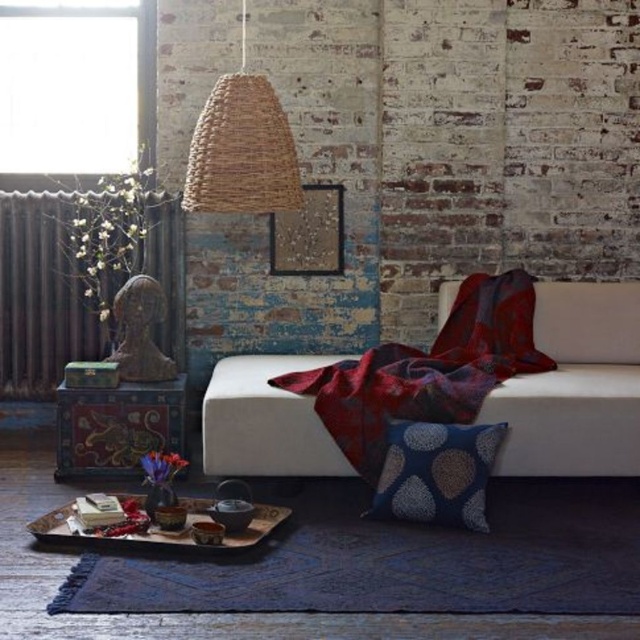
You are moving a small plant pot that is 20 cm in diameter. You want to place it on either the matte green radiator at left or the painted wood trunk at lower left. Which object can accommodate the plant pot without it falling off?

The matte green radiator at left is bigger than the painted wood trunk at lower left, so the plant pot will fit better on the matte green radiator at left.

You are a delivery person carrying a package that is 1 meter long. You need to place it between the blue dotted pillow at lower center and the painted wood trunk at lower left. Can the package fit in the space between them?

The blue dotted pillow at lower center is 1.11 meters away from the painted wood trunk at lower left. Since the package is 1 meter long, it can fit in the space between them as the distance is greater than the package length.

You are standing in the room and want to place a small teapot exactly where the blue dotted pillow at lower center is located. Is this possible?

The blue dotted pillow at lower center is located at point (436, 472), so placing the small teapot there would require moving the pillow first.